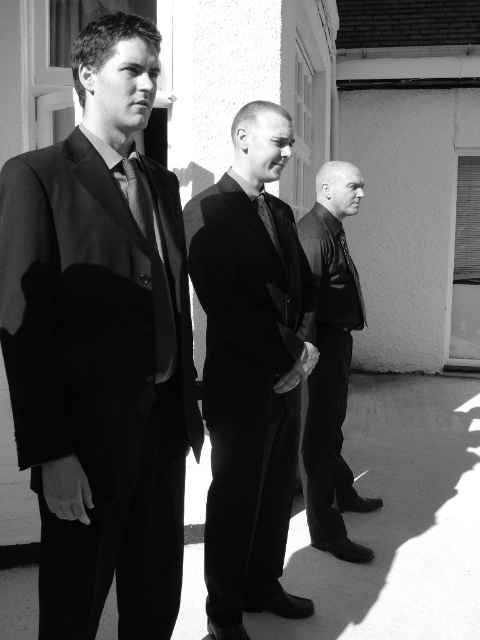
You are a photographer adjusting the framing of this black and white photo. You need to ensure both the smooth black jacket at center and the textured black tie at center are fully visible. Given their widths, which object requires more horizontal space in the frame?

The smooth black jacket at center requires more horizontal space in the frame because its width surpasses that of the textured black tie at center.

You are a photographer adjusting the camera focus on a tripod. The camera is currently focused on the matte black tie at left. If you want to shift the focus to the textured black tie at center without moving the camera, what should you do?

Since the distance between the matte black tie at left and the textured black tie at center is 33.72 inches, you need to adjust the focus ring on the camera lens to accommodate the increased distance. This will ensure the textured black tie at center becomes sharp while the matte black tie at left may become slightly blurred.

In the scene shown: You are a photographer trying to adjust the lighting for a group photo. You need to ensure that the matte black suit at left and the smooth black jacket at center are both well lit. According to the scene description, which object is positioned higher and might require more direct lighting to avoid shadows?

The matte black suit at left is located above the smooth black jacket at center, so it might require more direct lighting to avoid shadows.